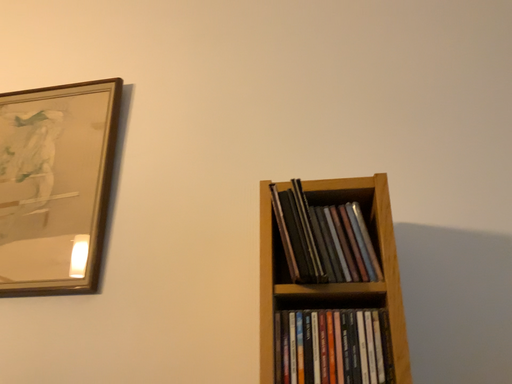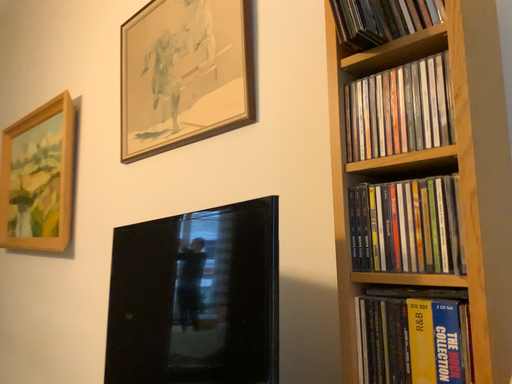
Question: How did the camera likely rotate when shooting the video?

Choices:
 (A) rotated upward
 (B) rotated downward

Answer: (B)